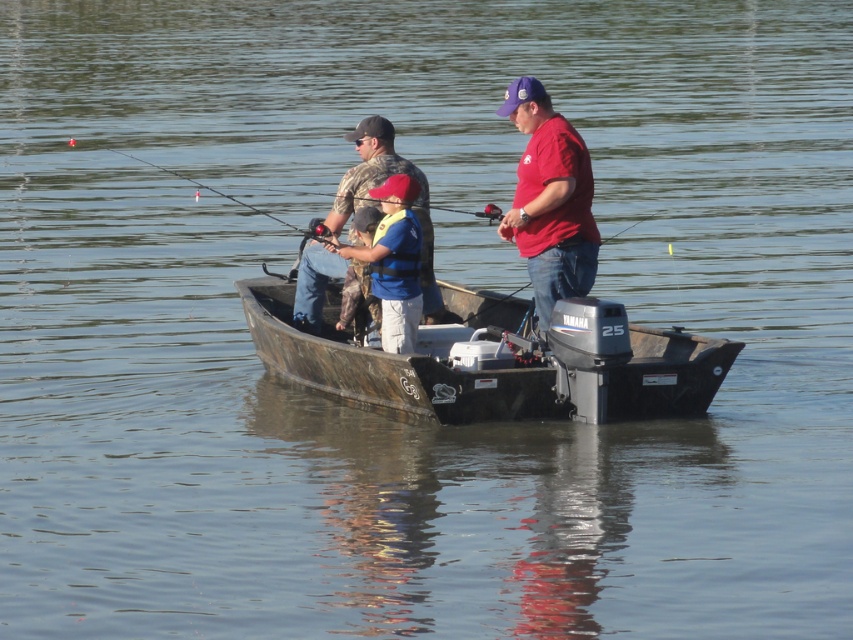
Find the location of a particular element. camouflage fabric boat at center is located at coordinates [x=498, y=364].

Does camouflage fabric boat at center have a greater width compared to camouflage fabric jacket at center?

Yes, camouflage fabric boat at center is wider than camouflage fabric jacket at center.

Measure the distance between camouflage fabric boat at center and camera.

camouflage fabric boat at center and camera are 13.81 meters apart.

Image resolution: width=853 pixels, height=640 pixels. I want to click on camouflage fabric boat at center, so click(x=498, y=364).

Is camouflage fabric boat at center bigger than blue life vest at center?

Yes.

Who is higher up, camouflage fabric boat at center or blue life vest at center?

blue life vest at center

The image size is (853, 640). I want to click on camouflage fabric boat at center, so 498,364.

The image size is (853, 640). Find the location of `camouflage fabric boat at center`. camouflage fabric boat at center is located at coordinates (498, 364).

Which is below, blue life vest at center or camouflage fabric jacket at center?

camouflage fabric jacket at center

This screenshot has width=853, height=640. What do you see at coordinates (393, 260) in the screenshot? I see `blue life vest at center` at bounding box center [393, 260].

Is point (376, 268) behind point (375, 317)?

No, (376, 268) is in front of (375, 317).

Locate an element on the screen. blue life vest at center is located at coordinates (393, 260).